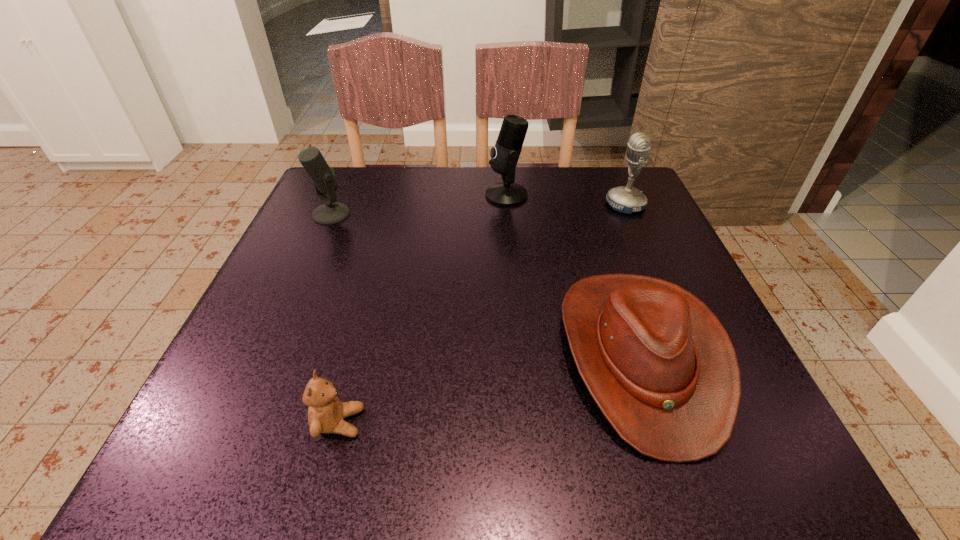
Locate an element on the screen. object positioned at the near right corner is located at coordinates coord(658,363).

You are a GUI agent. You are given a task and a screenshot of the screen. Output one action in this format:
    pyautogui.click(x=<x>, y=<y>)
    Task: Click on the free space at the far edge
    Image resolution: width=960 pixels, height=540 pixels.
    Given the screenshot: What is the action you would take?
    pyautogui.click(x=460, y=215)

At what (x,y) coordinates should I click in order to perform the action: click on free location at the near edge of the desktop. Please return your answer as a coordinate pair (x, y). This screenshot has width=960, height=540. Looking at the image, I should click on (425, 433).

This screenshot has height=540, width=960. I want to click on blank space at the left edge of the desktop, so click(x=347, y=240).

Where is `vacant space at the right edge`? This screenshot has height=540, width=960. vacant space at the right edge is located at coordinates (648, 240).

You are a GUI agent. You are given a task and a screenshot of the screen. Output one action in this format:
    pyautogui.click(x=<x>, y=<y>)
    Task: Click on the vacant space at the far left corner of the desktop
    This screenshot has height=540, width=960.
    Given the screenshot: What is the action you would take?
    pyautogui.click(x=315, y=189)

In the image, there is a desktop. Identify the location of vacant space at the near left corner. (279, 468).

Where is `vacant space at the near right corner of the desktop`? Image resolution: width=960 pixels, height=540 pixels. vacant space at the near right corner of the desktop is located at coordinates (784, 468).

Locate an element on the screen. vacant space in between the second microphone from left to right and the second object from left to right is located at coordinates (422, 309).

This screenshot has width=960, height=540. I want to click on vacant space that's between the leftmost microphone and the teddy bear, so click(x=335, y=318).